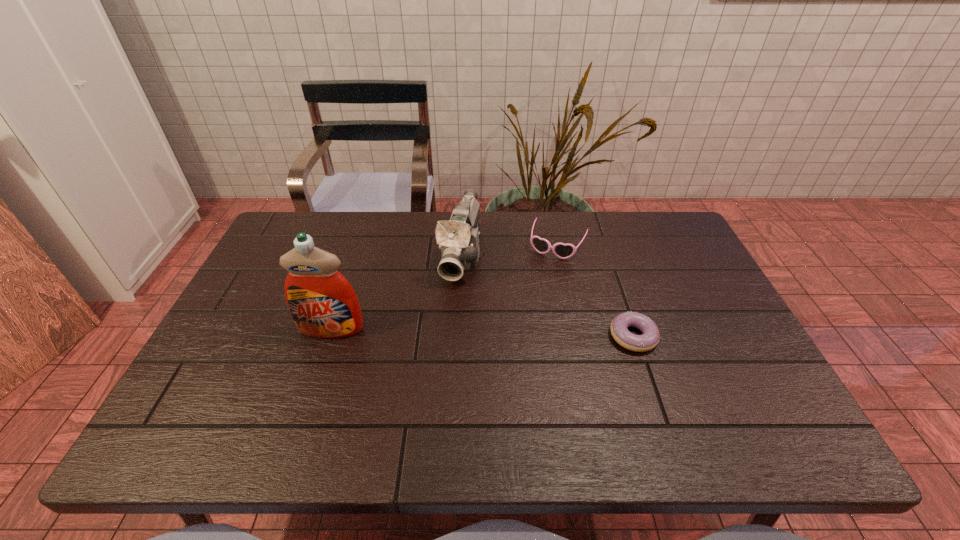
Where is `vacant space on the desktop that is between the tallest object and the shortest object and is positioned on the front-facing side of the sunglasses`? This screenshot has width=960, height=540. vacant space on the desktop that is between the tallest object and the shortest object and is positioned on the front-facing side of the sunglasses is located at coordinates (516, 334).

What are the coordinates of `vacant space on the desktop that is between the tallest object and the doughnut and is positioned on the front-facing side of the camcorder` in the screenshot? It's located at (437, 332).